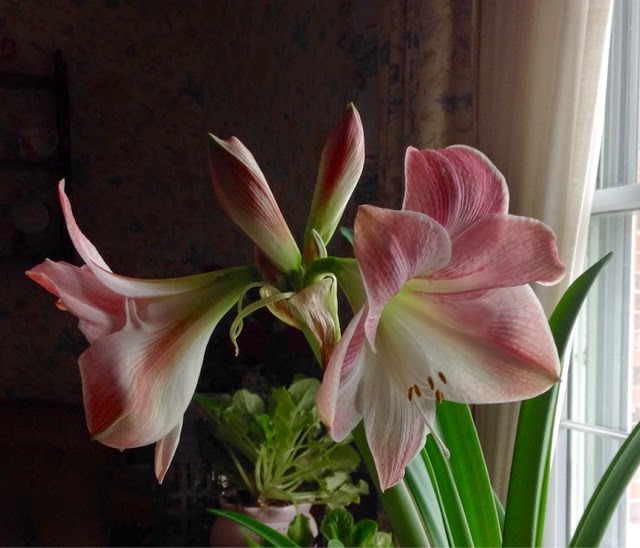
Identify the location of wall. (104, 105).